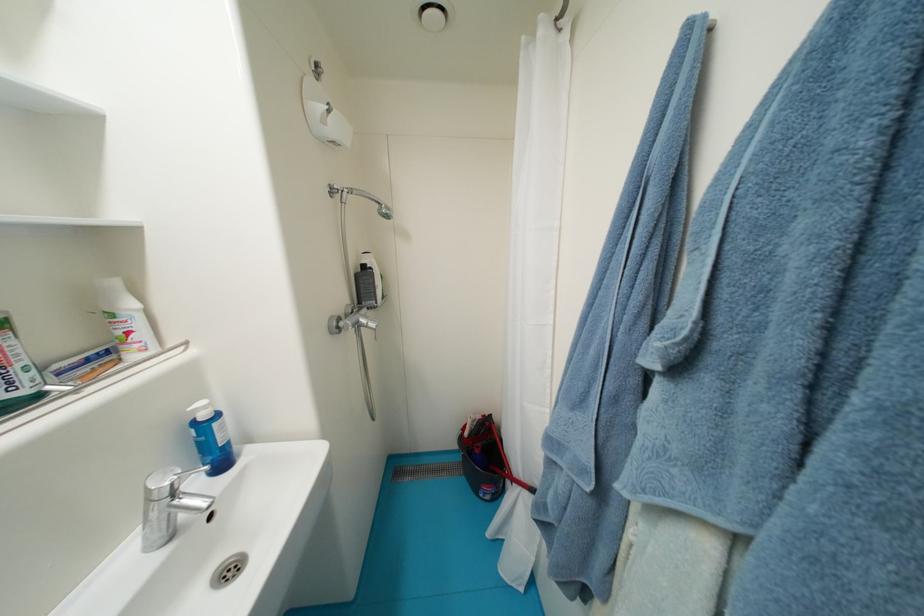
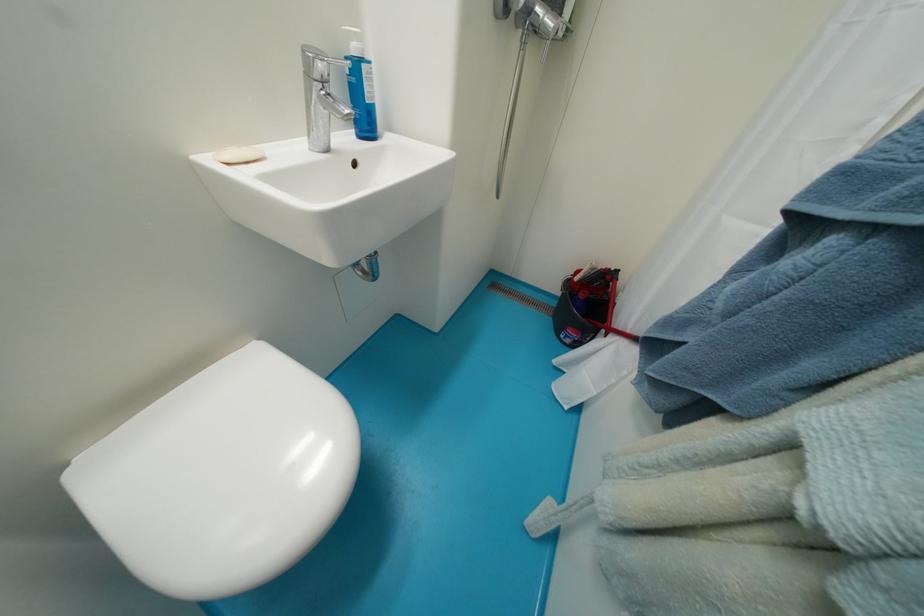
Locate, in the second image, the point that corresponds to pixel 156 501 in the first image.

(313, 78)